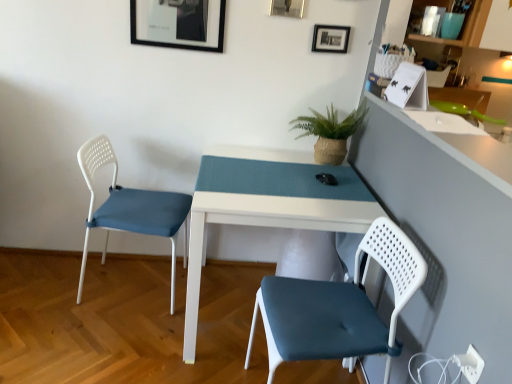
Find the location of a particular element. This screenshot has width=512, height=384. vacant space in between white plastic chair at left, which is the second chair from right to left, and white matte table at center is located at coordinates (138, 331).